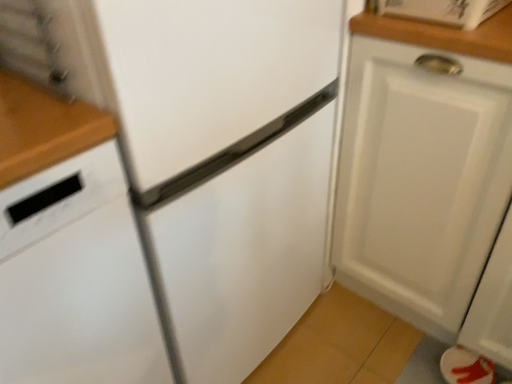
Question: Would you say white matte dishwasher at left is inside or outside white matte cabinet at right?

Choices:
 (A) inside
 (B) outside

Answer: (B)

Question: Looking at the image, does white matte dishwasher at left seem bigger or smaller compared to white matte cabinet at right?

Choices:
 (A) big
 (B) small

Answer: (B)

Question: Considering their positions, is white matte dishwasher at left located in front of or behind white matte cabinet at right?

Choices:
 (A) behind
 (B) front

Answer: (B)

Question: From their relative heights in the image, would you say white matte cabinet at right is taller or shorter than white matte dishwasher at left?

Choices:
 (A) tall
 (B) short

Answer: (B)

Question: Is point (458, 190) positioned closer to the camera than point (7, 322)?

Choices:
 (A) farther
 (B) closer

Answer: (A)

Question: Considering their positions, is white matte cabinet at right located in front of or behind white matte dishwasher at left?

Choices:
 (A) behind
 (B) front

Answer: (A)

Question: Considering the positions of white matte cabinet at right and white matte dishwasher at left in the image, is white matte cabinet at right wider or thinner than white matte dishwasher at left?

Choices:
 (A) thin
 (B) wide

Answer: (A)